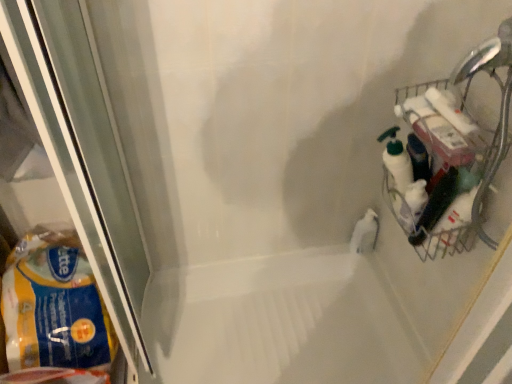
Question: Does white glossy bath at center appear on the right side of white glossy bottle at center?

Choices:
 (A) no
 (B) yes

Answer: (A)

Question: Is white glossy bath at center turned away from white glossy bottle at center?

Choices:
 (A) no
 (B) yes

Answer: (A)

Question: Is white glossy bath at center wider than white glossy bottle at center?

Choices:
 (A) yes
 (B) no

Answer: (A)

Question: Is there a large distance between white glossy bath at center and white glossy bottle at center?

Choices:
 (A) no
 (B) yes

Answer: (A)

Question: From the image's perspective, would you say white glossy bath at center is positioned over white glossy bottle at center?

Choices:
 (A) yes
 (B) no

Answer: (B)

Question: From the image's perspective, is white glossy bath at center below white glossy bottle at center?

Choices:
 (A) yes
 (B) no

Answer: (A)

Question: Can you confirm if yellow plastic bag at left is shorter than white glossy bottle at center?

Choices:
 (A) no
 (B) yes

Answer: (A)

Question: Is yellow plastic bag at left oriented towards white glossy bottle at center?

Choices:
 (A) no
 (B) yes

Answer: (A)

Question: From the image's perspective, is yellow plastic bag at left under white glossy bottle at center?

Choices:
 (A) no
 (B) yes

Answer: (B)

Question: Is yellow plastic bag at left positioned in front of white glossy bottle at center?

Choices:
 (A) yes
 (B) no

Answer: (A)

Question: Can you confirm if yellow plastic bag at left is smaller than white glossy bottle at center?

Choices:
 (A) yes
 (B) no

Answer: (B)

Question: Is yellow plastic bag at left next to white glossy bottle at center and touching it?

Choices:
 (A) no
 (B) yes

Answer: (A)

Question: Is yellow plastic bag at left positioned behind metallic wire basket at right?

Choices:
 (A) yes
 (B) no

Answer: (A)